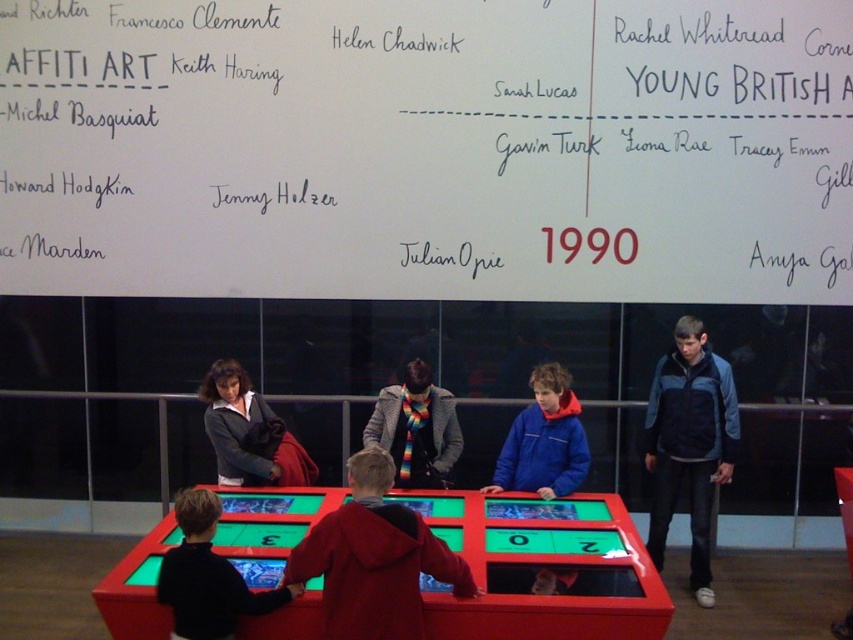
Question: Among these objects, which one is nearest to the camera?

Choices:
 (A) shiny plastic billiard table at center
 (B) black sweater at lower left
 (C) white paper at upper center

Answer: (A)

Question: Which point appears farthest from the camera in this image?

Choices:
 (A) (x=186, y=584)
 (B) (x=583, y=76)
 (C) (x=329, y=541)

Answer: (B)

Question: In this image, where is red hoodie at center located relative to rainbow scarf at center?

Choices:
 (A) left
 (B) right

Answer: (A)

Question: Which of the following is the closest to the observer?

Choices:
 (A) (556, 394)
 (B) (671, 480)
 (C) (397, 387)

Answer: (A)

Question: Can you confirm if red hoodie at center is positioned below blue fleece jacket at right?

Choices:
 (A) no
 (B) yes

Answer: (B)

Question: Is white paper at upper center below shiny plastic billiard table at center?

Choices:
 (A) yes
 (B) no

Answer: (B)